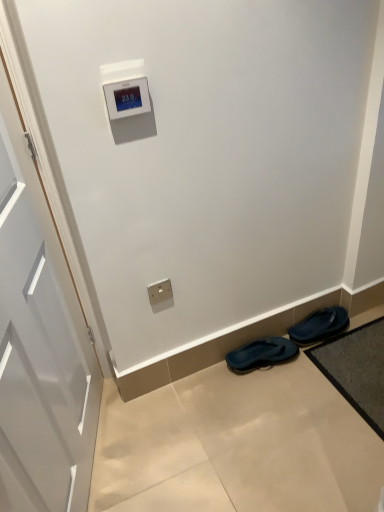
Where is `vacant space situated on the left part of dark blue rubber flip-flops at lower right, the 1th footwear viewed from the left`? vacant space situated on the left part of dark blue rubber flip-flops at lower right, the 1th footwear viewed from the left is located at coordinates (209, 387).